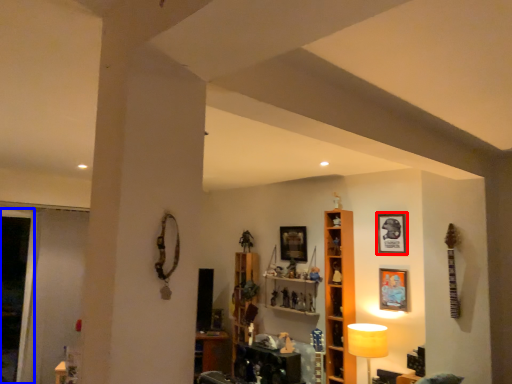
Question: Among these objects, which one is nearest to the camera, picture frame (highlighted by a red box) or glass door (highlighted by a blue box)?

Choices:
 (A) picture frame
 (B) glass door

Answer: (A)